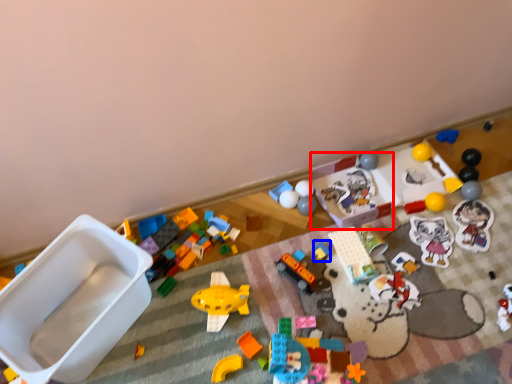
Question: Among these objects, which one is nearest to the camera, toy (highlighted by a red box) or toy (highlighted by a blue box)?

Choices:
 (A) toy
 (B) toy

Answer: (B)